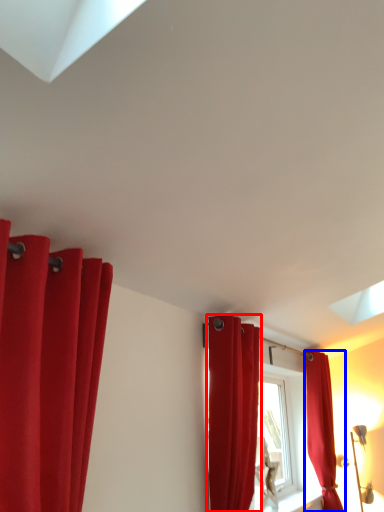
Question: Which object appears closest to the camera in this image, curtain (highlighted by a red box) or curtain (highlighted by a blue box)?

Choices:
 (A) curtain
 (B) curtain

Answer: (A)